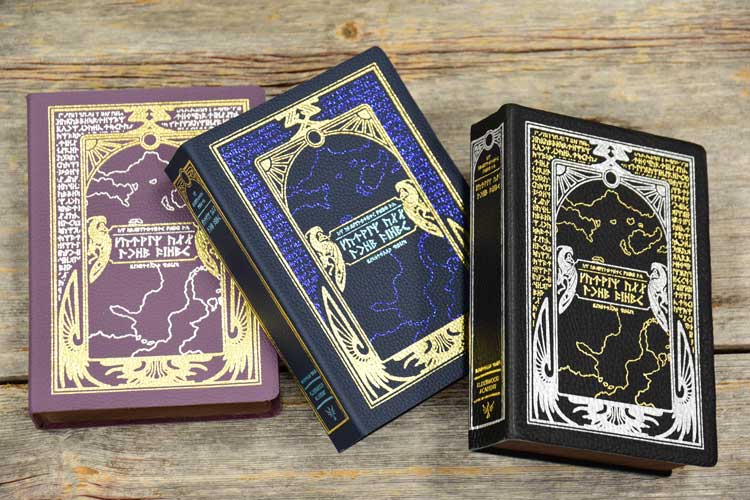
This screenshot has height=500, width=750. What are the coordinates of `black book is slightly positioned on top of the blue one` in the screenshot? It's located at 508,297.